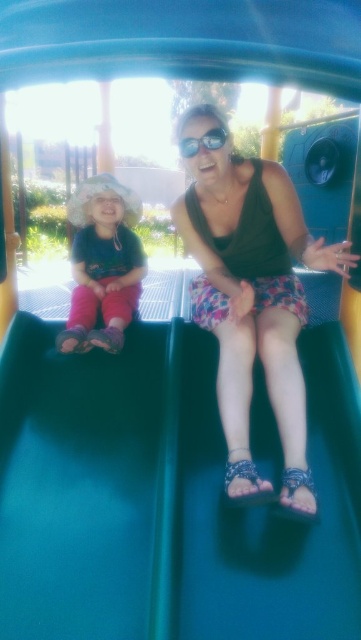
From the picture: You are a photographer trying to capture the best angle of the two people on the slide. Since the matte brown tank top at center and the matte pink pants at left are positioned differently, which one is lower in the image?

The matte brown tank top at center is below matte pink pants at left, so it is lower in the image.

You are a child standing at the bottom of the green smooth slide at center and the shiny black goggles at center. You want to climb up to the top. Which object should you grab first to reach the top?

The green smooth slide at center is positioned on the left side of shiny black goggles at center, so you should grab the green smooth slide at center first to reach the top.

You are a photographer trying to capture a closeup shot of both the matte brown tank top at center and the matte pink pants at left. Your camera has a maximum focus range of 20 inches. Can you fit both subjects within the camera range without moving the camera?

The matte brown tank top at center is 22.90 inches away from the matte pink pants at left. Since the distance between them exceeds the camera maximum focus range of 20 inches, you cannot fit both subjects within the camera range without moving the camera.